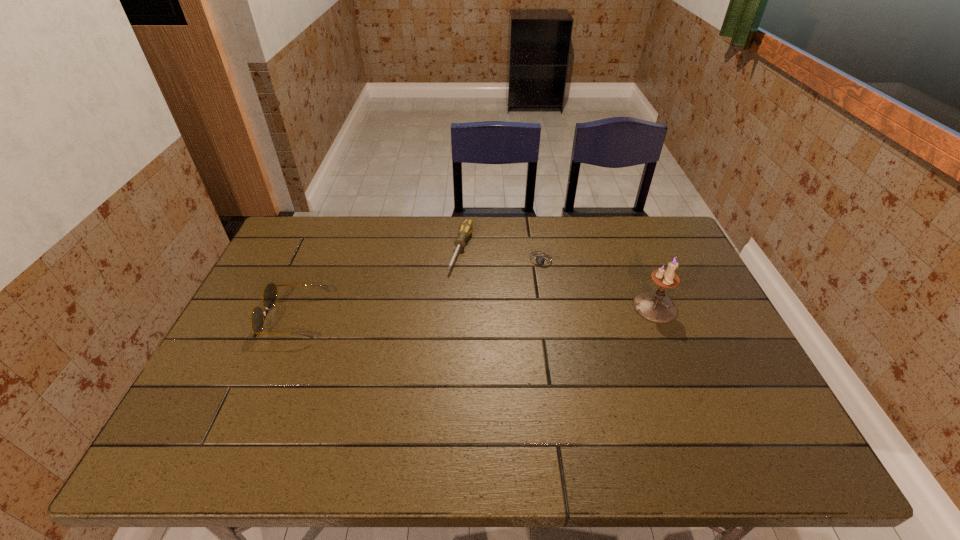
Find the location of a particular element. This screenshot has height=540, width=960. vacant space on the desktop that is between the third shortest object and the tallest object and is positioned at the tip of the third object from right to left is located at coordinates (435, 314).

I want to click on free spot on the desktop that is between the second tallest object and the tallest object and is positioned on the face of the third object from left to right, so click(511, 312).